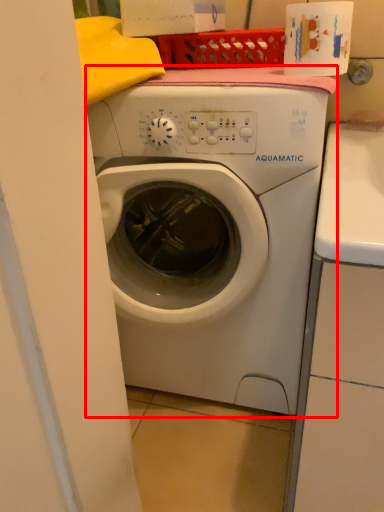
Question: Where is washing machine (annotated by the red box) located in relation to toilet paper in the image?

Choices:
 (A) left
 (B) right

Answer: (A)